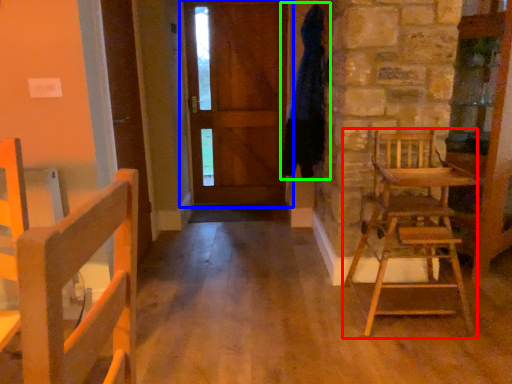
Question: Based on their relative distances, which object is nearer to chair (highlighted by a red box)? Choose from door (highlighted by a blue box) and bathrobe (highlighted by a green box).

Choices:
 (A) door
 (B) bathrobe

Answer: (B)